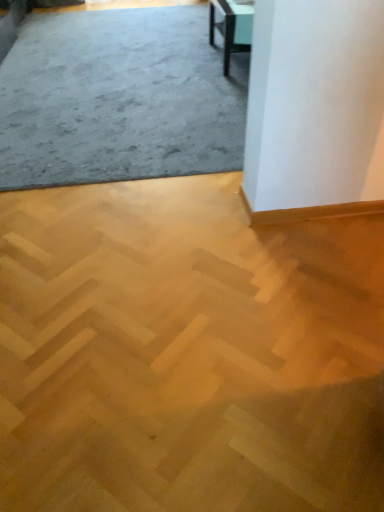
Question: Which direction should I rotate to look at light brown wood parquet at center, which is counted as the first concrete, starting from the front, — up or down?

Choices:
 (A) down
 (B) up

Answer: (A)

Question: Can you confirm if light brown wood parquet at center, the 2th concrete from the back, is shorter than matte black table at upper right?

Choices:
 (A) yes
 (B) no

Answer: (A)

Question: Does light brown wood parquet at center, the 2th concrete from the back, appear on the right side of matte black table at upper right?

Choices:
 (A) no
 (B) yes

Answer: (A)

Question: Does light brown wood parquet at center, the 1th concrete positioned from the bottom, lie in front of matte black table at upper right?

Choices:
 (A) no
 (B) yes

Answer: (B)

Question: From the image's perspective, would you say light brown wood parquet at center, which is the 2th concrete from top to bottom, is positioned over matte black table at upper right?

Choices:
 (A) yes
 (B) no

Answer: (B)

Question: From the image's perspective, is light brown wood parquet at center, which is counted as the first concrete, starting from the front, located beneath matte black table at upper right?

Choices:
 (A) yes
 (B) no

Answer: (A)

Question: Does light brown wood parquet at center, which is the 2th concrete from top to bottom, turn towards matte black table at upper right?

Choices:
 (A) yes
 (B) no

Answer: (B)

Question: Could you tell me if gray carpet at upper left, the second concrete when ordered from front to back, is facing matte black table at upper right?

Choices:
 (A) yes
 (B) no

Answer: (B)

Question: From the image's perspective, is gray carpet at upper left, placed as the first concrete when sorted from top to bottom, below matte black table at upper right?

Choices:
 (A) yes
 (B) no

Answer: (A)

Question: Can you confirm if gray carpet at upper left, which appears as the 2th concrete when ordered from the bottom, is positioned to the left of matte black table at upper right?

Choices:
 (A) yes
 (B) no

Answer: (A)

Question: Considering the relative sizes of gray carpet at upper left, which appears as the 2th concrete when ordered from the bottom, and matte black table at upper right in the image provided, is gray carpet at upper left, which appears as the 2th concrete when ordered from the bottom, thinner than matte black table at upper right?

Choices:
 (A) no
 (B) yes

Answer: (A)

Question: Is matte black table at upper right at the back of gray carpet at upper left, acting as the 1th concrete starting from the back?

Choices:
 (A) yes
 (B) no

Answer: (B)

Question: From a real-world perspective, is gray carpet at upper left, acting as the 1th concrete starting from the back, physically above matte black table at upper right?

Choices:
 (A) yes
 (B) no

Answer: (B)

Question: Is matte black table at upper right oriented away from light brown wood parquet at center, which is the 2th concrete from top to bottom?

Choices:
 (A) no
 (B) yes

Answer: (A)